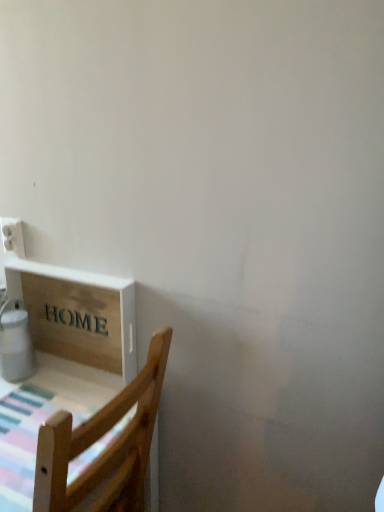
Locate an element on the screen. This screenshot has width=384, height=512. free space in front of white glossy water heater at lower left is located at coordinates (19, 404).